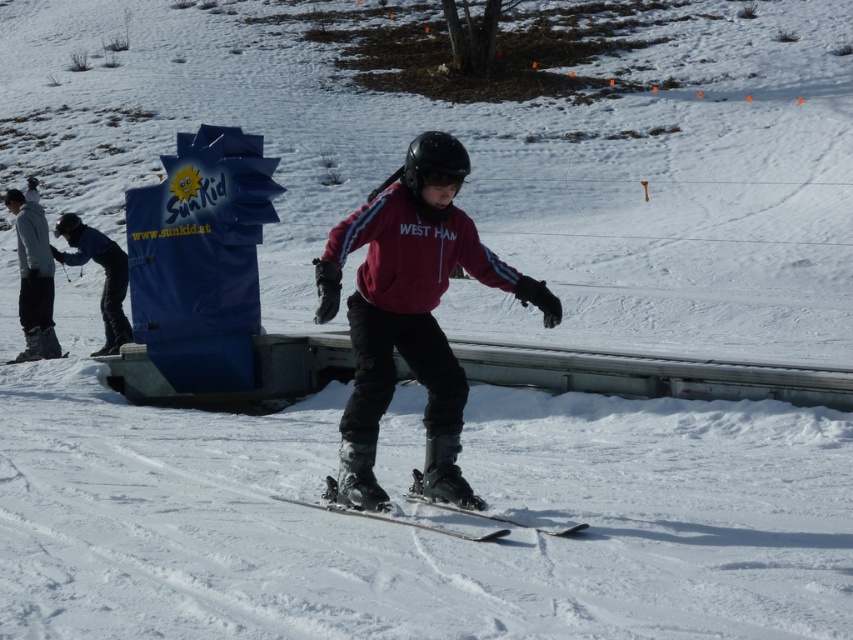
Question: Does matte red jacket at center have a lesser width compared to gray fleece jacket at left?

Choices:
 (A) no
 (B) yes

Answer: (A)

Question: Is the position of matte red jacket at center less distant than that of gray fleece jacket at left?

Choices:
 (A) no
 (B) yes

Answer: (B)

Question: Among these objects, which one is farthest from the camera?

Choices:
 (A) matte red jacket at center
 (B) black matte ski at center
 (C) blue fabric sign at left

Answer: (C)

Question: Which point is farther from the camera taking this photo?

Choices:
 (A) (45, 333)
 (B) (88, 244)
 (C) (451, 188)
 (D) (279, 496)

Answer: (B)

Question: Is matte red jacket at center positioned in front of blue fabric sign at left?

Choices:
 (A) no
 (B) yes

Answer: (B)

Question: Which point is farther to the camera?

Choices:
 (A) gray fleece jacket at left
 (B) matte red jacket at center

Answer: (A)